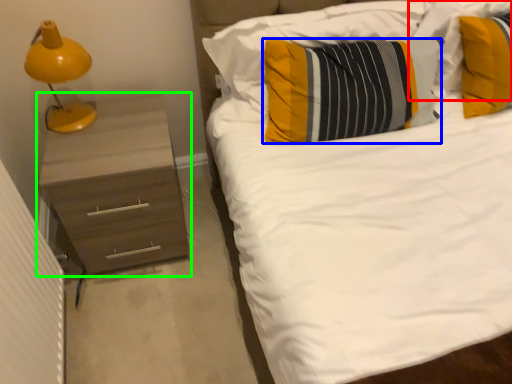
Question: Based on their relative distances, which object is nearer to pillow (highlighted by a red box)? Choose from pillow (highlighted by a blue box) and chest of drawers (highlighted by a green box).

Choices:
 (A) pillow
 (B) chest of drawers

Answer: (A)